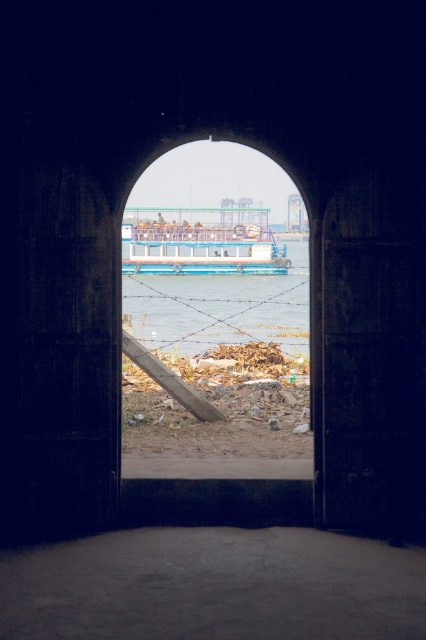
Question: Is clear water at center thinner than blue painted metal boat at center?

Choices:
 (A) yes
 (B) no

Answer: (A)

Question: Which of the following is the closest to the observer?

Choices:
 (A) (137, 337)
 (B) (265, 220)
 (C) (166, 248)

Answer: (A)

Question: Which of the following is the farthest from the observer?

Choices:
 (A) blue painted boat at center
 (B) clear water at center

Answer: (B)

Question: Does clear water at center appear under blue painted metal boat at center?

Choices:
 (A) yes
 (B) no

Answer: (A)

Question: Where is clear water at center located in relation to blue painted metal boat at center in the image?

Choices:
 (A) right
 (B) left

Answer: (B)

Question: Considering the real-world distances, which object is farthest from the clear water at center?

Choices:
 (A) blue painted metal boat at center
 (B) blue painted boat at center

Answer: (A)